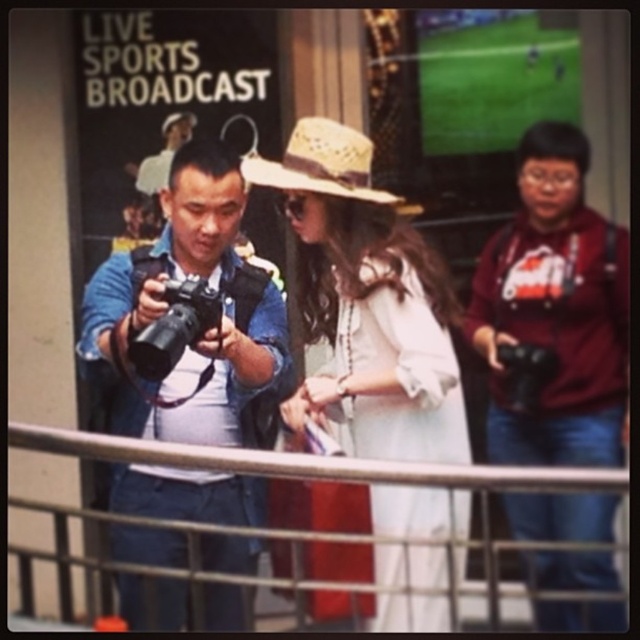
Between matte black camera at center and metallic silver railing at center, which one appears on the left side from the viewer's perspective?

From the viewer's perspective, matte black camera at center appears more on the left side.

Which is below, matte black camera at center or metallic silver railing at center?

metallic silver railing at center

Image resolution: width=640 pixels, height=640 pixels. I want to click on matte black camera at center, so click(x=166, y=307).

Does metallic silver railing at center appear over black plastic camera at right?

Incorrect, metallic silver railing at center is not positioned above black plastic camera at right.

Who is taller, metallic silver railing at center or black plastic camera at right?

black plastic camera at right is taller.

Locate an element on the screen. metallic silver railing at center is located at coordinates (310, 461).

Is white cotton dress at center bigger than strawmaterial/texturehat at center?

Yes, white cotton dress at center is bigger than strawmaterial/texturehat at center.

Does white cotton dress at center appear under strawmaterial/texturehat at center?

Indeed, white cotton dress at center is positioned under strawmaterial/texturehat at center.

Find the location of a particular element. The width and height of the screenshot is (640, 640). white cotton dress at center is located at coordinates (365, 305).